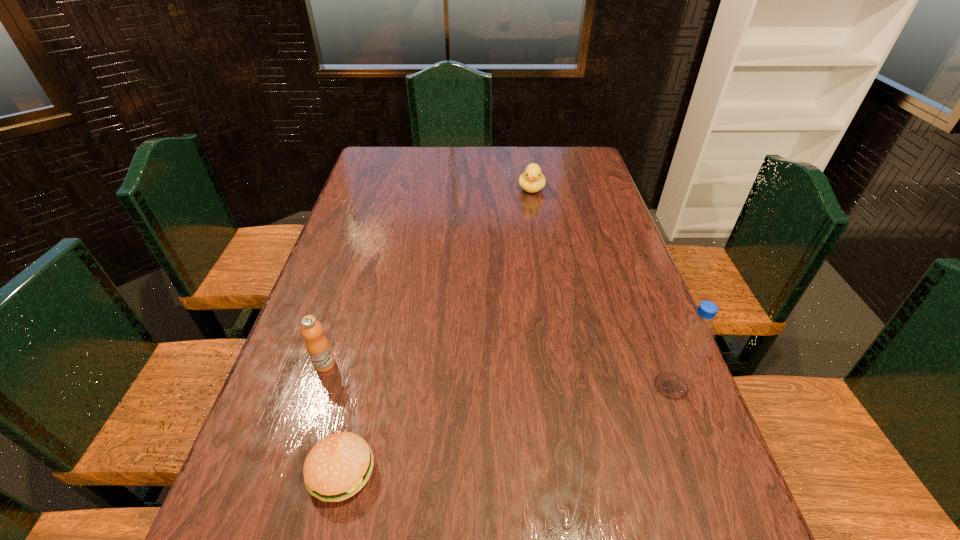
Where is `patty`? Image resolution: width=960 pixels, height=540 pixels. patty is located at coordinates (339, 465).

Where is `the shortest object`? The height and width of the screenshot is (540, 960). the shortest object is located at coordinates (339, 465).

I want to click on the tallest object, so click(x=695, y=335).

Locate an element on the screen. The width and height of the screenshot is (960, 540). the rightmost object is located at coordinates (695, 335).

At what (x,y) coordinates should I click in order to perform the action: click on the second object from right to left. Please return your answer as a coordinate pair (x, y). This screenshot has width=960, height=540. Looking at the image, I should click on (532, 180).

Where is `duckling`? This screenshot has width=960, height=540. duckling is located at coordinates (532, 180).

What are the coordinates of `the leftmost object` in the screenshot? It's located at (318, 347).

Identify the location of the second tallest object. This screenshot has height=540, width=960. (318, 347).

Locate an element on the screen. The width and height of the screenshot is (960, 540). blank space located on the left of the shortest object is located at coordinates (272, 471).

Find the location of a particular element. vacant region located 0.090m on the back of the rightmost object is located at coordinates (656, 342).